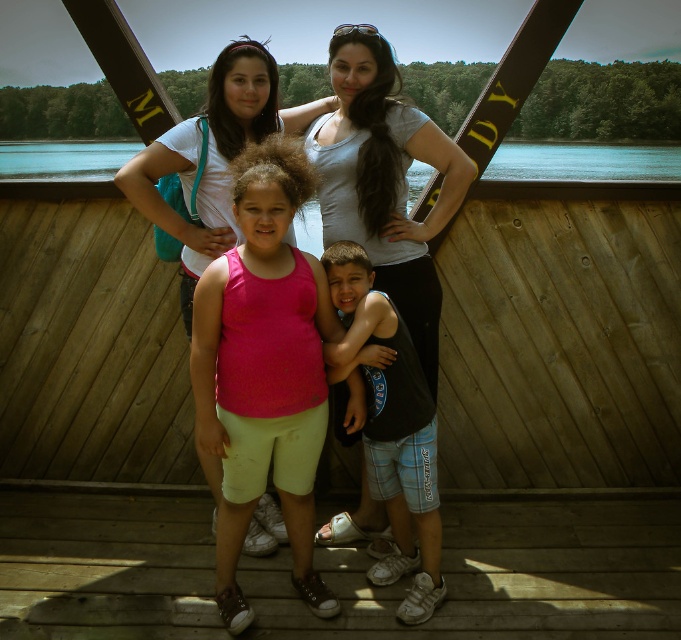
You are standing on the brown wooden deck at center and looking up at the pink fabric tank top at center. Which object is taller?

The pink fabric tank top at center is taller than the brown wooden deck at center.

You are trying to decide which object in the scene is wider. You see a matte gray tank top at center and a transparent blue water at upper center. Which one is wider?

The matte gray tank top at center is wider than the transparent blue water at upper center according to the description.

You are standing on the brown wooden deck at center and want to reach the pink fabric tank top at center. Which direction should you move to get closer to it?

The brown wooden deck at center is positioned under the pink fabric tank top at center, so you should move upward to get closer to it.